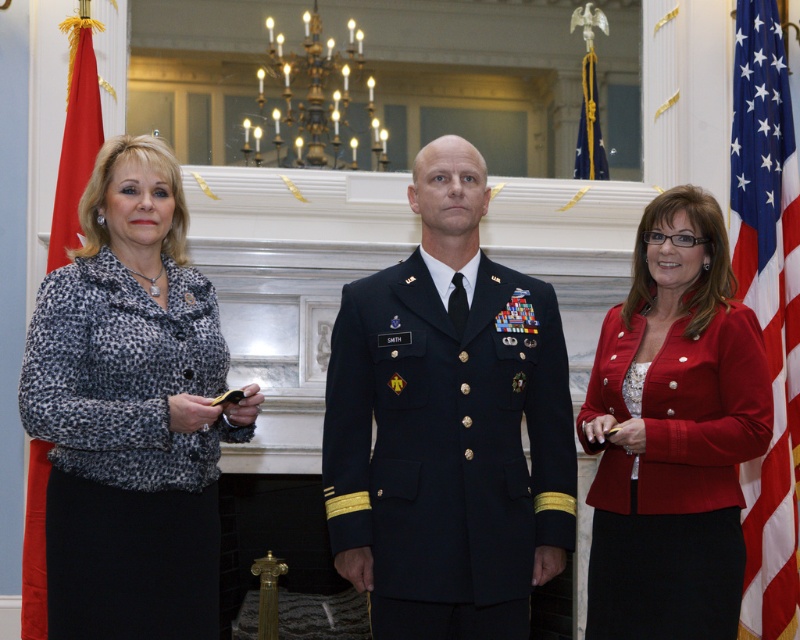
You are a photographer adjusting your camera to focus on two specific points in the image. The first point is labeled as point (36, 296) and the second is point (66, 230). Since you can only focus on one point at a time, which point should you choose to ensure the foreground elements are sharp?

Point (36, 296) is closer to the camera than point (66, 230). Therefore, to focus on the foreground elements, you should choose point (36, 296).

You are organizing a charity event and need to determine which of the two garments, the red satin blazer at center or the leopard print fabric at left, can be folded into a smaller storage space. Based on their thickness, which one would require less space?

The red satin blazer at center is thinner than the leopard print fabric at left, so it would require less storage space and can be folded into a smaller area.